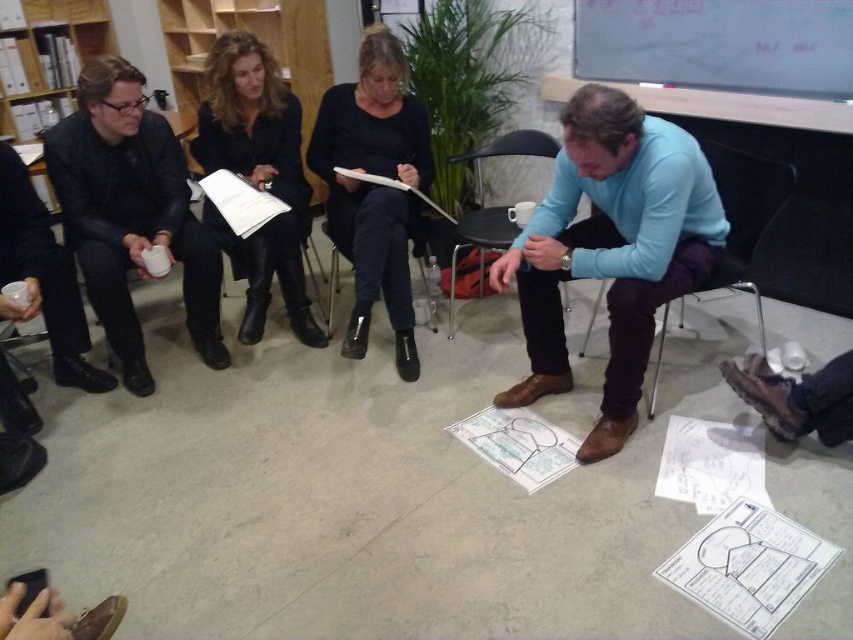
You are a photographer standing at the camera position. You want to take a clear photo of the white paper at lower center. What is the minimum distance you need to maintain between the camera and the white paper to ensure the photo is in focus?

The minimum distance you need to maintain between the camera and the white paper at lower center is 1.55 meters, as they are already 1.55 meters apart according to the description.